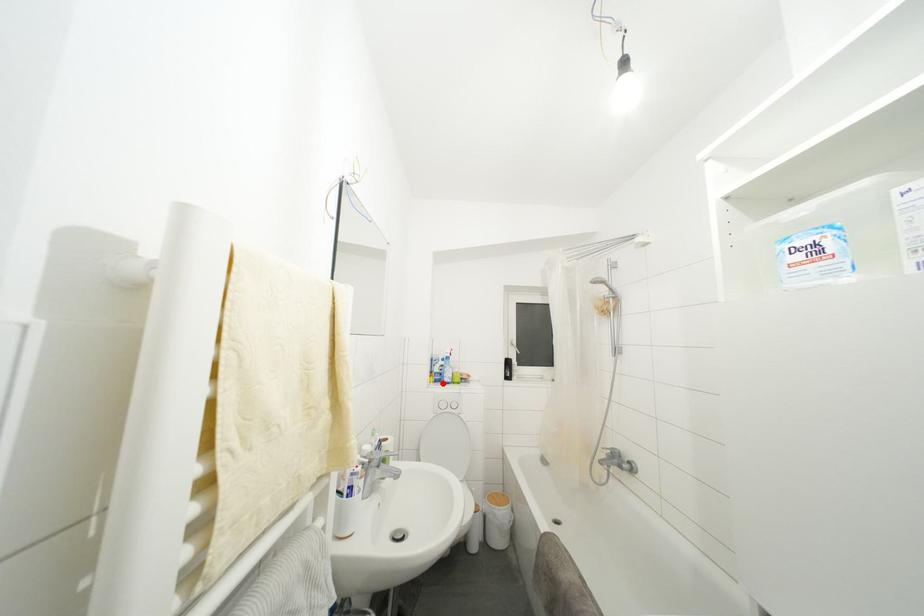
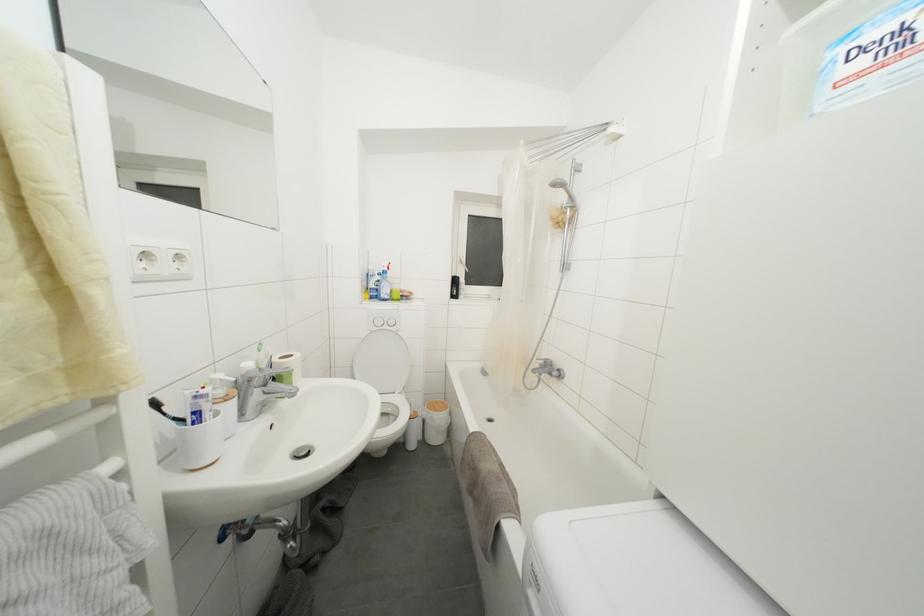
Locate, in the second image, the point that corresponds to the highlighted location in the first image.

(379, 300)